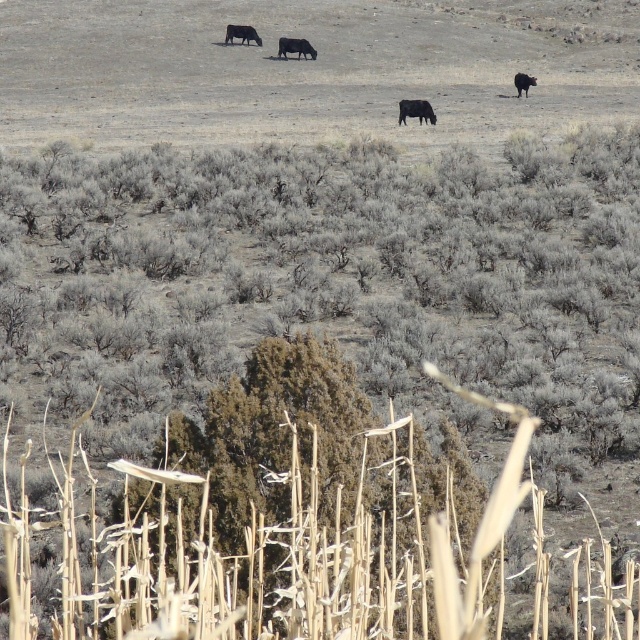
Question: In this image, where is black matte cow at upper center located relative to black matte cow at upper right?

Choices:
 (A) below
 (B) above

Answer: (B)

Question: Among these objects, which one is farthest from the camera?

Choices:
 (A) black matte cow at center
 (B) black glossy cow at center
 (C) black matte cow at upper center
 (D) black matte cow at upper right

Answer: (C)

Question: Which of the following is the farthest from the observer?

Choices:
 (A) black matte cow at center
 (B) black glossy cow at center
 (C) black matte cow at upper right

Answer: (A)

Question: Observing the image, what is the correct spatial positioning of black glossy cow at center in reference to black matte cow at center?

Choices:
 (A) right
 (B) left

Answer: (A)

Question: Can you confirm if black matte cow at center is positioned to the right of black matte cow at upper right?

Choices:
 (A) yes
 (B) no

Answer: (B)

Question: Considering the real-world distances, which object is closest to the black matte cow at upper center?

Choices:
 (A) black matte cow at center
 (B) black glossy cow at center

Answer: (A)